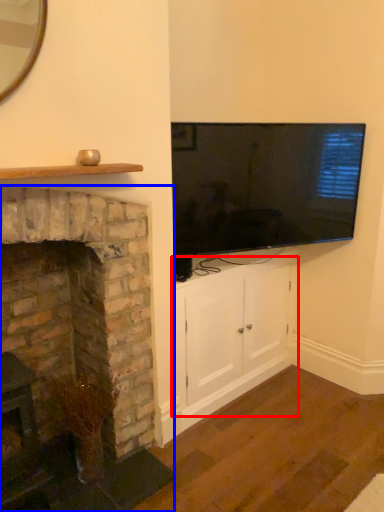
Question: Among these objects, which one is farthest to the camera, cabinetry (highlighted by a red box) or fireplace (highlighted by a blue box)?

Choices:
 (A) cabinetry
 (B) fireplace

Answer: (A)